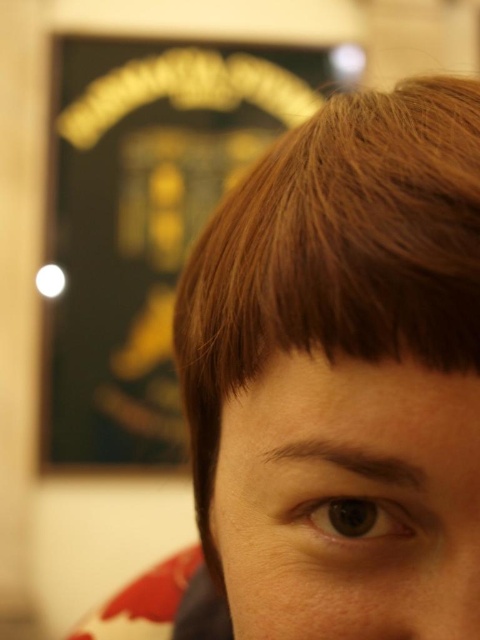
Question: Which point appears farthest from the camera in this image?

Choices:
 (A) (277, 458)
 (B) (206, 218)

Answer: (B)

Question: Which point is farther to the camera?

Choices:
 (A) [304, 538]
 (B) [324, 545]

Answer: (A)

Question: Can you confirm if brown matte hair at upper right is positioned below gold metallic sign at upper center?

Choices:
 (A) yes
 (B) no

Answer: (A)

Question: Does brown matte hair at upper right appear on the left side of gold metallic sign at upper center?

Choices:
 (A) yes
 (B) no

Answer: (B)

Question: Does brown matte hair at upper right appear over smooth skin eye at center?

Choices:
 (A) yes
 (B) no

Answer: (A)

Question: Which point appears farthest from the camera in this image?

Choices:
 (A) (351, 429)
 (B) (90, 381)
 (C) (356, 307)

Answer: (B)